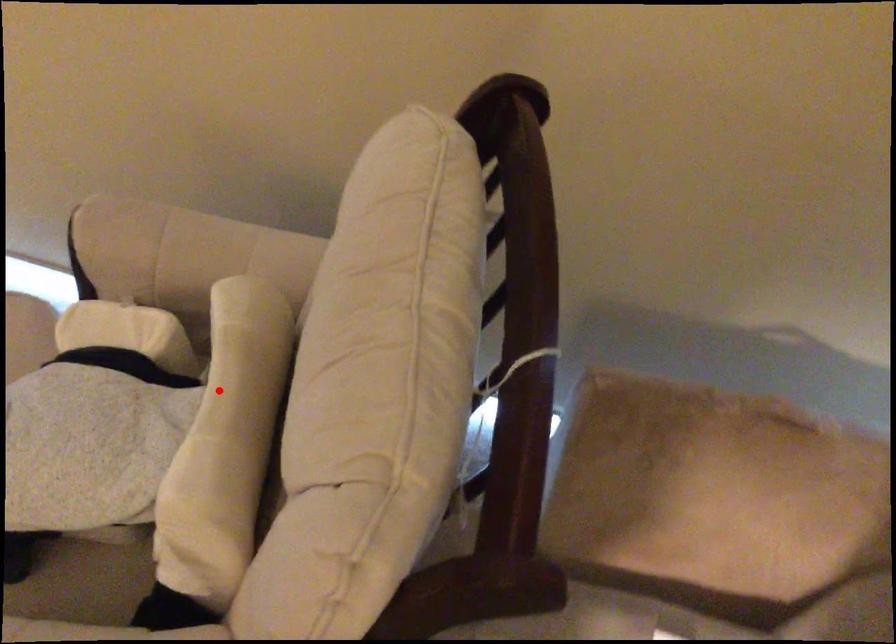
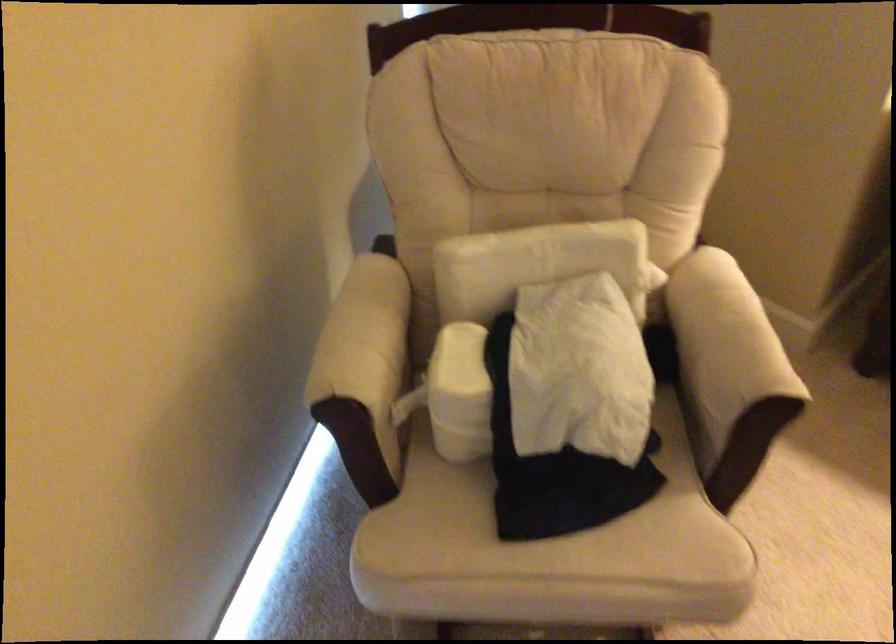
Find the pixel in the second image that matches the highlighted location in the first image.

(533, 263)